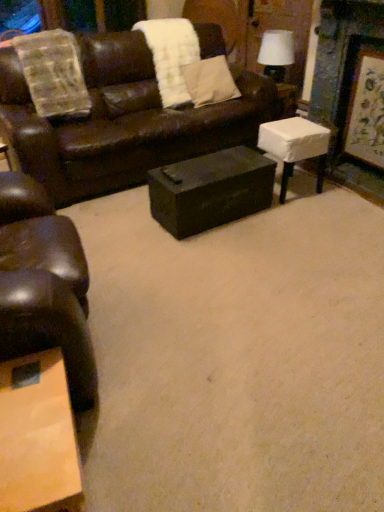
Question: Considering the positions of beige fabric pillow at upper center and white fluffy blanket at upper center in the image, is beige fabric pillow at upper center wider or thinner than white fluffy blanket at upper center?

Choices:
 (A) wide
 (B) thin

Answer: (B)

Question: Based on their positions, is beige fabric pillow at upper center located to the left or right of white fluffy blanket at upper center?

Choices:
 (A) right
 (B) left

Answer: (A)

Question: Which of these objects is positioned farthest from the white fabric lampshade at upper right?

Choices:
 (A) wooden coffee table at lower left
 (B) white fluffy blanket at upper center
 (C) wooden framed artwork at right
 (D) beige fabric pillow at upper center
 (E) brown leather couch at upper center

Answer: (A)

Question: Considering the real-world distances, which object is closest to the white fabric-covered stool at right, the second table in the left-to-right sequence?

Choices:
 (A) wooden coffee table at lower left
 (B) shiny brown leather chair at left
 (C) matte black trunk at center, the second table when ordered from right to left
 (D) white fabric lampshade at upper right
 (E) beige fabric pillow at upper center

Answer: (C)